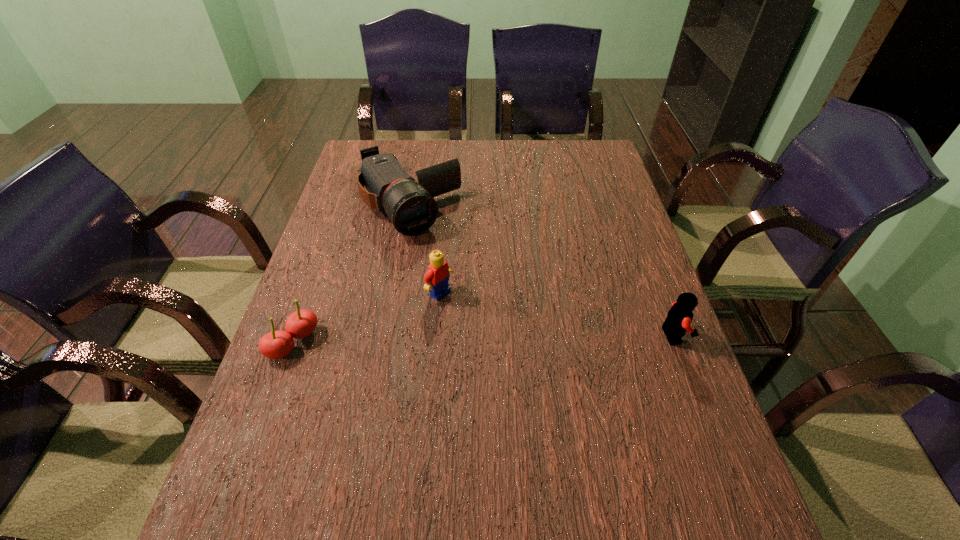
You are a GUI agent. You are given a task and a screenshot of the screen. Output one action in this format:
    pyautogui.click(x=<x>, y=<y>)
    Task: Click on the shortest object
    Image resolution: width=960 pixels, height=540 pixels.
    Given the screenshot: What is the action you would take?
    pyautogui.click(x=277, y=344)

The width and height of the screenshot is (960, 540). I want to click on the nearer Lego, so click(678, 321).

The width and height of the screenshot is (960, 540). In order to click on the right Lego in this screenshot , I will do `click(678, 321)`.

Where is `camcorder`? This screenshot has height=540, width=960. camcorder is located at coordinates (410, 206).

Locate an element on the screen. This screenshot has width=960, height=540. the second farthest object is located at coordinates (436, 278).

This screenshot has height=540, width=960. What are the coordinates of `the left Lego` in the screenshot? It's located at (436, 278).

Locate an element on the screen. The height and width of the screenshot is (540, 960). vacant space located 0.130m on the back of the shortest object is located at coordinates (315, 282).

Where is `free spot located on the lens of the farthest object`? The image size is (960, 540). free spot located on the lens of the farthest object is located at coordinates (456, 270).

You are a GUI agent. You are given a task and a screenshot of the screen. Output one action in this format:
    pyautogui.click(x=<x>, y=<y>)
    Task: Click on the free space located 0.340m on the lens of the farthest object
    Image resolution: width=960 pixels, height=540 pixels.
    Given the screenshot: What is the action you would take?
    pyautogui.click(x=492, y=319)

At what (x,y) coordinates should I click in order to perform the action: click on free space located on the lens of the farthest object. Please return your answer as a coordinate pair (x, y). Image resolution: width=960 pixels, height=540 pixels. Looking at the image, I should click on (478, 300).